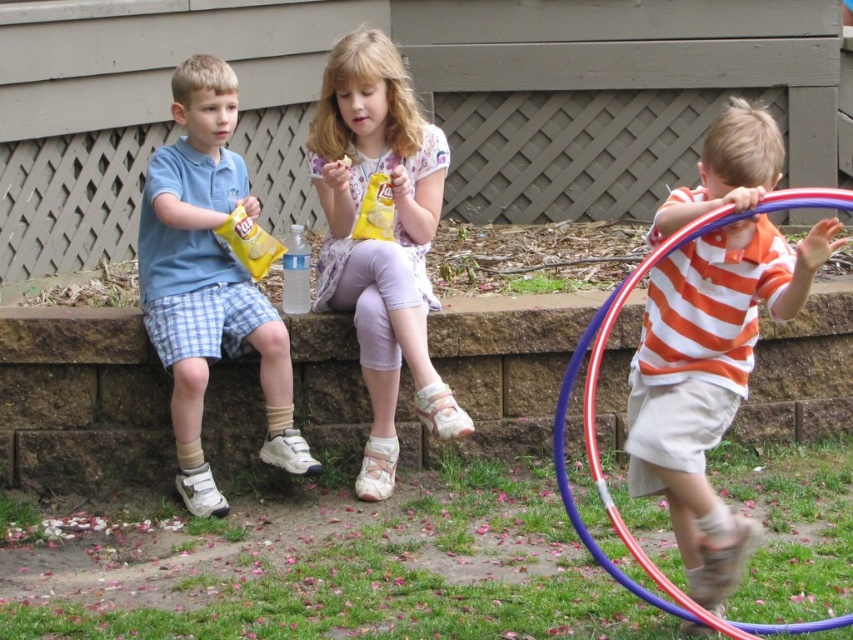
Does matte yellow snack packet at center lie in front of matte blue shirt at left?

No, matte yellow snack packet at center is behind matte blue shirt at left.

Is matte yellow snack packet at center to the right of matte blue shirt at left from the viewer's perspective?

Indeed, matte yellow snack packet at center is positioned on the right side of matte blue shirt at left.

I want to click on matte yellow snack packet at center, so click(380, 240).

Can you confirm if matte blue shirt at left is positioned to the left of metallic blue and red hula hoop at right?

Yes, matte blue shirt at left is to the left of metallic blue and red hula hoop at right.

Locate an element on the screen. matte blue shirt at left is located at coordinates (207, 280).

The image size is (853, 640). Find the location of `matte blue shirt at left`. matte blue shirt at left is located at coordinates (207, 280).

The image size is (853, 640). Describe the element at coordinates (380, 240) in the screenshot. I see `matte yellow snack packet at center` at that location.

Is matte yellow snack packet at center below metallic blue and red hula hoop at right?

No.

At what (x,y) coordinates should I click in order to perform the action: click on matte yellow snack packet at center. Please return your answer as a coordinate pair (x, y). The width and height of the screenshot is (853, 640). Looking at the image, I should click on (380, 240).

Find the location of a particular element. matte yellow snack packet at center is located at coordinates (380, 240).